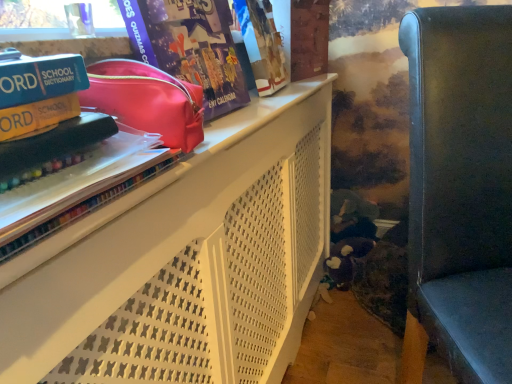
Question: Can we say teal matte school dictionary at upper left, which is the second paperback book in bottom-to-top order, lies outside white matte shelf at upper left?

Choices:
 (A) yes
 (B) no

Answer: (A)

Question: Does teal matte school dictionary at upper left, the 1th paperback book viewed from the top, have a lesser height compared to white matte shelf at upper left?

Choices:
 (A) yes
 (B) no

Answer: (A)

Question: Considering the relative positions of teal matte school dictionary at upper left, which is the second paperback book in bottom-to-top order, and white matte shelf at upper left in the image provided, is teal matte school dictionary at upper left, which is the second paperback book in bottom-to-top order, to the right of white matte shelf at upper left from the viewer's perspective?

Choices:
 (A) no
 (B) yes

Answer: (A)

Question: Is teal matte school dictionary at upper left, the 1th paperback book viewed from the top, next to white matte shelf at upper left and touching it?

Choices:
 (A) no
 (B) yes

Answer: (A)

Question: Is teal matte school dictionary at upper left, which is the second paperback book in bottom-to-top order, facing towards white matte shelf at upper left?

Choices:
 (A) no
 (B) yes

Answer: (A)

Question: Is the depth of teal matte school dictionary at upper left, which is the second paperback book in bottom-to-top order, less than that of white matte shelf at upper left?

Choices:
 (A) no
 (B) yes

Answer: (A)

Question: From the image's perspective, is translucent plastic book at upper left beneath shiny pink pouch at upper center?

Choices:
 (A) no
 (B) yes

Answer: (B)

Question: From a real-world perspective, is translucent plastic book at upper left on top of shiny pink pouch at upper center?

Choices:
 (A) yes
 (B) no

Answer: (B)

Question: Is translucent plastic book at upper left surrounding shiny pink pouch at upper center?

Choices:
 (A) yes
 (B) no

Answer: (B)

Question: Is translucent plastic book at upper left further to camera compared to shiny pink pouch at upper center?

Choices:
 (A) yes
 (B) no

Answer: (B)

Question: Is translucent plastic book at upper left turned away from shiny pink pouch at upper center?

Choices:
 (A) no
 (B) yes

Answer: (A)

Question: Is translucent plastic book at upper left wider than shiny pink pouch at upper center?

Choices:
 (A) yes
 (B) no

Answer: (A)

Question: Can you confirm if white matte shelf at upper left is positioned to the right of shiny pink pouch at upper center?

Choices:
 (A) yes
 (B) no

Answer: (A)